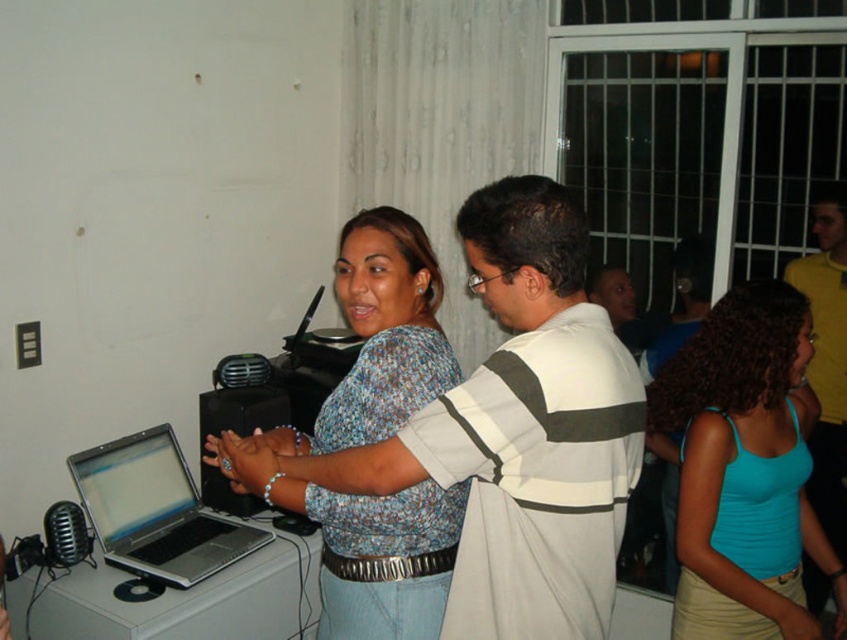
Question: Is teal fabric tank top at center positioned behind yellow cotton shirt at upper right?

Choices:
 (A) yes
 (B) no

Answer: (B)

Question: Which point appears farthest from the camera in this image?

Choices:
 (A) (545, 186)
 (B) (252, 394)
 (C) (837, 461)
 (D) (754, 420)

Answer: (C)

Question: Is silver/black laptop at left to the left of yellow cotton shirt at upper right from the viewer's perspective?

Choices:
 (A) yes
 (B) no

Answer: (A)

Question: Which object appears closest to the camera in this image?

Choices:
 (A) teal fabric tank top at center
 (B) silver/black laptop at left
 (C) white striped shirt at center
 (D) black glossy laptop at center

Answer: (C)

Question: From the image, what is the correct spatial relationship of teal fabric tank top at center in relation to silver/black laptop at left?

Choices:
 (A) left
 (B) right

Answer: (B)

Question: Among these points, which one is farthest from the camera?

Choices:
 (A) (671, 420)
 (B) (823, 294)
 (C) (245, 472)
 (D) (219, 419)

Answer: (B)